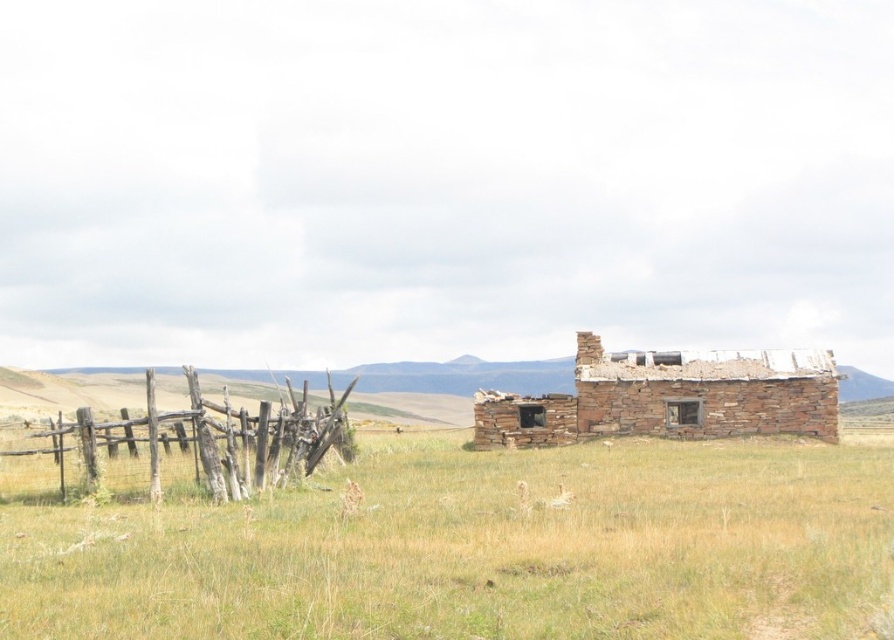
Question: Which of the following is the farthest from the observer?

Choices:
 (A) (205, 451)
 (B) (516, 438)

Answer: (B)

Question: Can you confirm if brown grassy field at center is bigger than weathered wood fence at left?

Choices:
 (A) no
 (B) yes

Answer: (A)

Question: Does brown grassy field at center have a lesser width compared to weathered wood fence at left?

Choices:
 (A) no
 (B) yes

Answer: (A)

Question: Is rustic stone hut at right further to camera compared to weathered wood fence at left?

Choices:
 (A) no
 (B) yes

Answer: (B)

Question: Which point is closer to the camera?

Choices:
 (A) pyautogui.click(x=0, y=580)
 (B) pyautogui.click(x=39, y=452)

Answer: (A)

Question: Which point appears closest to the camera in this image?

Choices:
 (A) (715, 390)
 (B) (319, 536)
 (C) (313, 464)

Answer: (B)